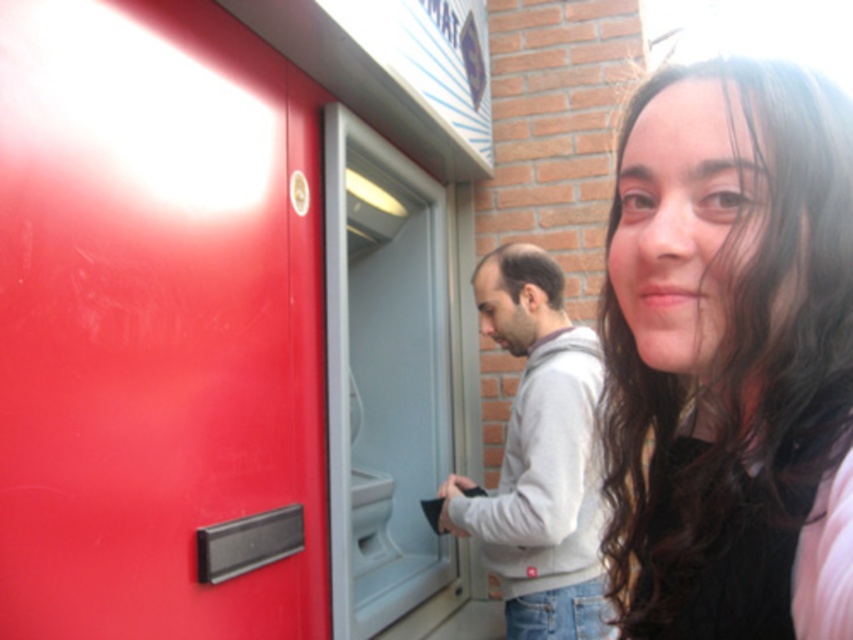
You are a photographer standing in front of the ATM scene. You notice the smooth brown hair at upper right and the gray fleece hoodie at center. Which object is located higher in the image?

The smooth brown hair at upper right is positioned over the gray fleece hoodie at center, so it is higher in the image.

You are a photographer trying to capture a clear shot of the smooth brown hair at upper right and the gray fleece hoodie at center. Which object should you focus on first to ensure it appears sharp in the photo?

The gray fleece hoodie at center should be focused on first because it occupies more space than the smooth brown hair at upper right, making it a primary subject for sharpness.